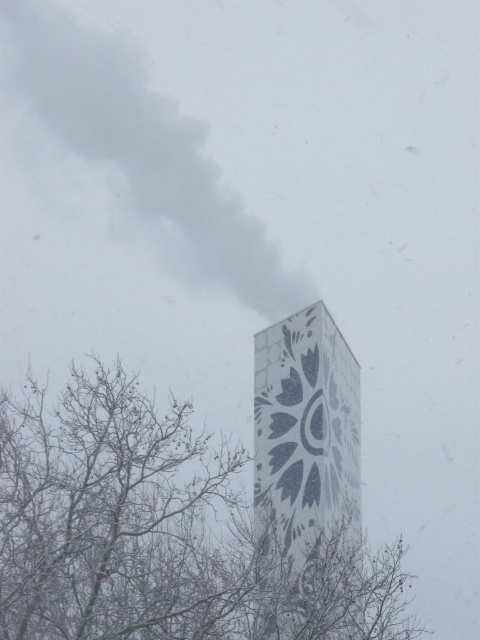
Is point (84, 492) closer to viewer compared to point (313, 420)?

Yes.

What are the coordinates of `bare branches at center` in the screenshot? It's located at (162, 531).

Locate an element on the screen. The width and height of the screenshot is (480, 640). bare branches at center is located at coordinates (162, 531).

Is white textured tower at center wider than gray smoke at upper center?

No.

Between white textured tower at center and gray smoke at upper center, which one appears on the left side from the viewer's perspective?

gray smoke at upper center is more to the left.

The image size is (480, 640). I want to click on white textured tower at center, so click(x=307, y=477).

Is bare branches at center thinner than gray smoke at upper center?

Incorrect, bare branches at center's width is not less than gray smoke at upper center's.

Is bare branches at center to the left of gray smoke at upper center from the viewer's perspective?

In fact, bare branches at center is to the right of gray smoke at upper center.

Who is more forward, (339, 540) or (194, 152)?

Point (339, 540)

Image resolution: width=480 pixels, height=640 pixels. I want to click on bare branches at center, so click(162, 531).